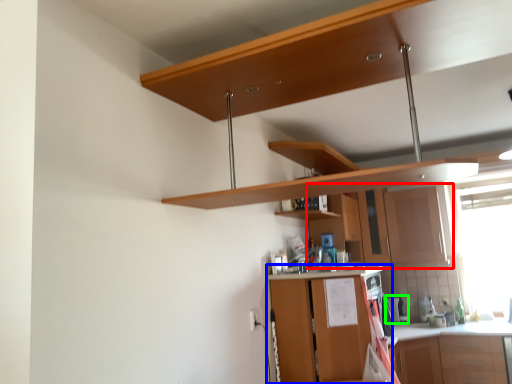
Question: Which object is positioned closest to cabinetry (highlighted by a red box)? Select from cabinetry (highlighted by a blue box) and appliance (highlighted by a green box).

Choices:
 (A) cabinetry
 (B) appliance

Answer: (B)